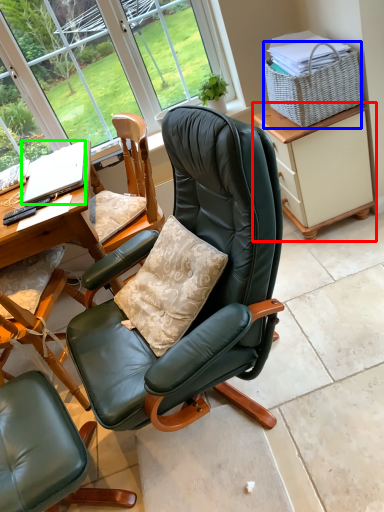
Question: Which is farther away from cabinetry (highlighted by a red box)? picnic basket (highlighted by a blue box) or laptop (highlighted by a green box)?

Choices:
 (A) picnic basket
 (B) laptop

Answer: (B)